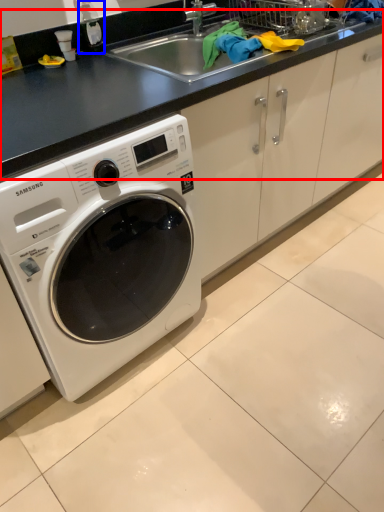
Question: Which object is closer to the camera taking this photo, counter top (highlighted by a red box) or bottle (highlighted by a blue box)?

Choices:
 (A) counter top
 (B) bottle

Answer: (A)